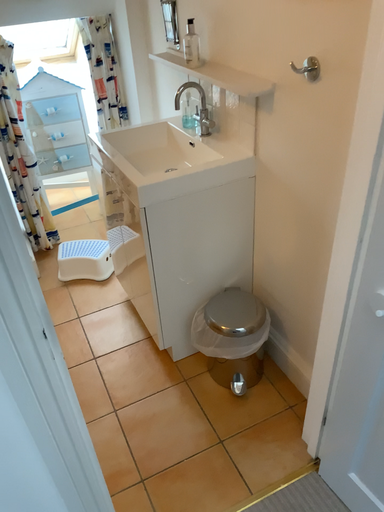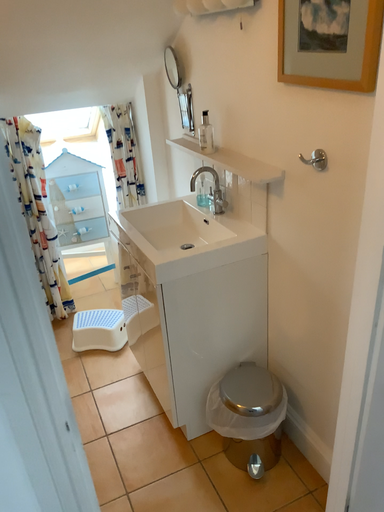
Question: How did the camera likely rotate when shooting the video?

Choices:
 (A) rotated upward
 (B) rotated downward

Answer: (A)